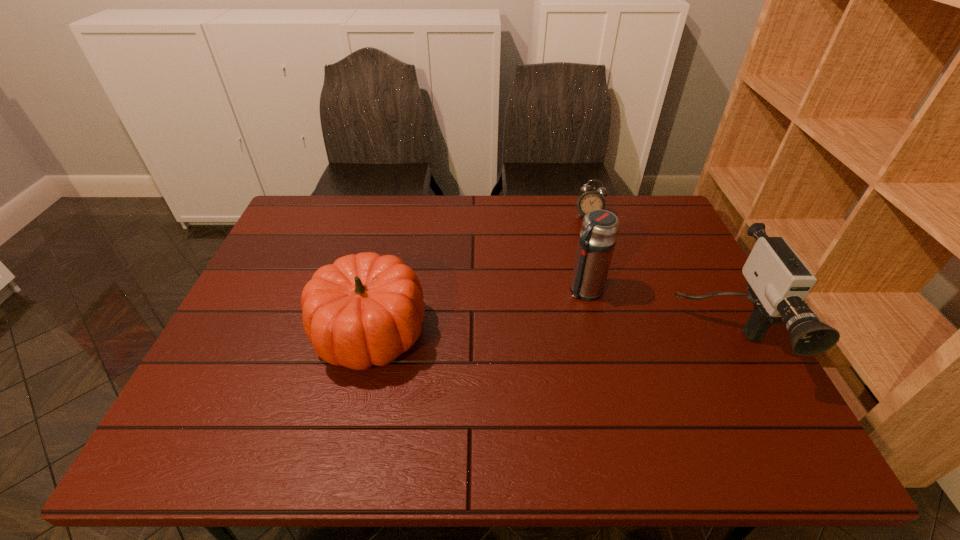
Identify the location of pumpkin. (365, 309).

Locate an element on the screen. This screenshot has height=540, width=960. the third tallest object is located at coordinates (365, 309).

Locate an element on the screen. The width and height of the screenshot is (960, 540). the rightmost object is located at coordinates (778, 281).

Where is `the farthest object`? the farthest object is located at coordinates (591, 199).

Locate an element on the screen. alarm clock is located at coordinates (591, 199).

You are a GUI agent. You are given a task and a screenshot of the screen. Output one action in this format:
    pyautogui.click(x=<x>, y=<y>)
    Task: Click on the thermos bottle
    The image size is (960, 540).
    Given the screenshot: What is the action you would take?
    pyautogui.click(x=599, y=230)

Where is `free space located on the back of the pumpkin`? Image resolution: width=960 pixels, height=540 pixels. free space located on the back of the pumpkin is located at coordinates (394, 230).

You are a GUI agent. You are given a task and a screenshot of the screen. Output one action in this format:
    pyautogui.click(x=<x>, y=<y>)
    Task: Click on the vacant space located 0.050m on the recording direction of the rightmost object
    
    Given the screenshot: What is the action you would take?
    pyautogui.click(x=760, y=408)

The width and height of the screenshot is (960, 540). What are the coordinates of `vacant space situated 0.060m on the face of the farthest object` in the screenshot? It's located at (584, 234).

The image size is (960, 540). I want to click on free space located on the face of the farthest object, so click(567, 303).